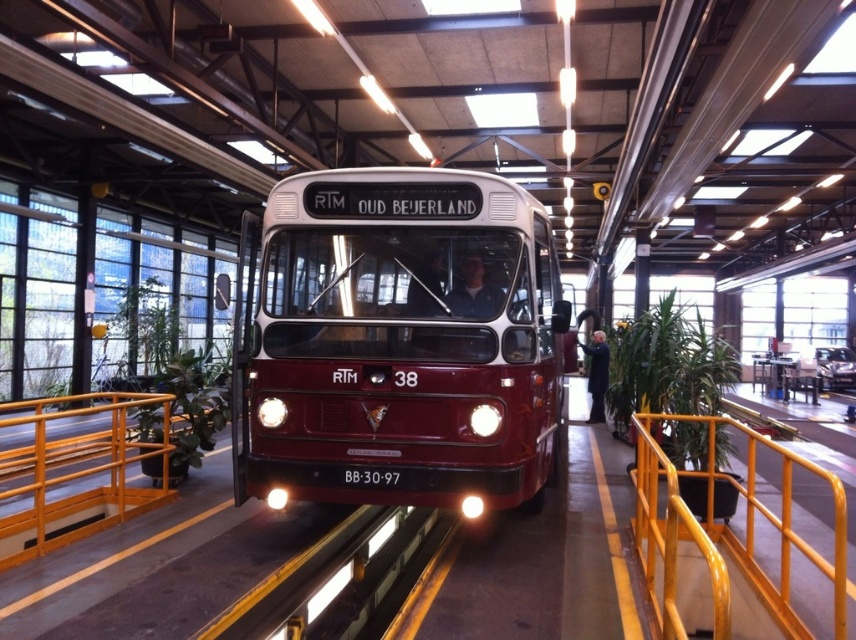
Does maroon matte bus at center lie behind yellow metal rail at lower left?

A: No, maroon matte bus at center is in front of yellow metal rail at lower left.

Does maroon matte bus at center have a lesser width compared to yellow metal rail at lower left?

Incorrect, maroon matte bus at center's width is not less than yellow metal rail at lower left's.

This screenshot has width=856, height=640. I want to click on maroon matte bus at center, so click(x=399, y=342).

Between yellow metal railing at center and yellow metal rail at lower left, which one has more height?

With more height is yellow metal railing at center.

At what (x,y) coordinates should I click in order to perform the action: click on yellow metal railing at center. Please return your answer as a coordinate pair (x, y). Looking at the image, I should click on (727, 531).

Is point (744, 554) farther from viewer compared to point (9, 541)?

No, (744, 554) is closer to viewer.

Find the location of `yellow metal railing at center`. yellow metal railing at center is located at coordinates pyautogui.click(x=727, y=531).

Is the position of maroon matte bus at center less distant than that of yellow metal railing at center?

No, it is behind yellow metal railing at center.

Between maroon matte bus at center and yellow metal railing at center, which one appears on the left side from the viewer's perspective?

maroon matte bus at center

Who is more distant from viewer, (x=251, y=321) or (x=752, y=509)?

The point (x=251, y=321) is behind.

The image size is (856, 640). What are the coordinates of `maroon matte bus at center` in the screenshot? It's located at (399, 342).